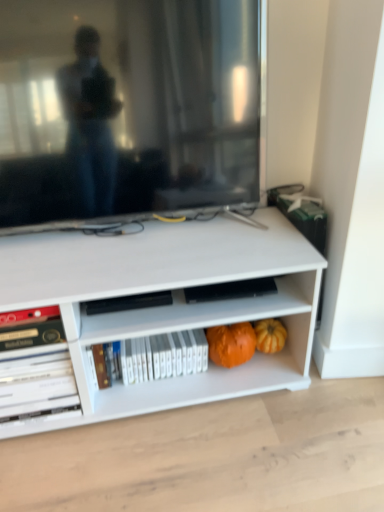
Image resolution: width=384 pixels, height=512 pixels. I want to click on free spot in front of orange matte pumpkin at lower right, placed as the 1th pumpkin when sorted from right to left, so click(272, 399).